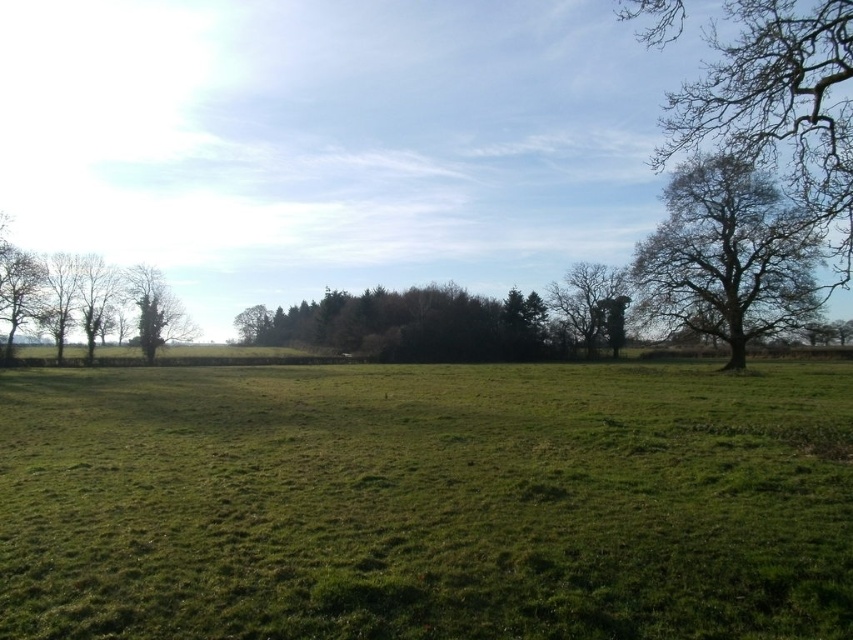
Question: Based on their relative distances, which object is nearer to the green grassy field at center?

Choices:
 (A) green leafy tree at left
 (B) bare wood tree at center
 (C) green leafy trees at left

Answer: (C)

Question: Which object appears farthest from the camera in this image?

Choices:
 (A) green leafy tree at right
 (B) green grassy field at center

Answer: (A)

Question: Does bare branches at upper right appear on the left side of green leafy trees at center?

Choices:
 (A) no
 (B) yes

Answer: (A)

Question: Which point is farther from the camera taking this photo?

Choices:
 (A) (38, 275)
 (B) (148, 321)
 (C) (691, 285)
 (D) (805, 588)

Answer: (B)

Question: Is green leafy tree at right positioned behind green leafy tree at left?

Choices:
 (A) no
 (B) yes

Answer: (A)

Question: In this image, where is green leafy tree at right located relative to green leafy trees at left?

Choices:
 (A) left
 (B) right

Answer: (B)